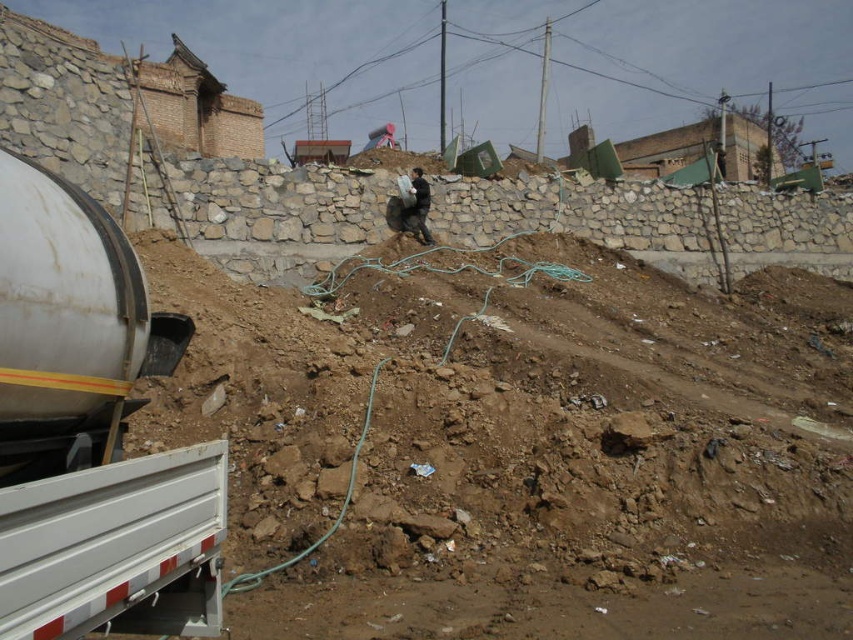
Measure the distance between white matte trailer truck at lower left and white metallic trailer truck at lower left.

white matte trailer truck at lower left and white metallic trailer truck at lower left are 1.12 meters apart from each other.

Does white matte trailer truck at lower left come behind white metallic trailer truck at lower left?

Yes.

Identify the location of white matte trailer truck at lower left. The image size is (853, 640). (88, 422).

Can you confirm if brown dirt at center is smaller than white metallic trailer truck at lower left?

Actually, brown dirt at center might be larger than white metallic trailer truck at lower left.

Who is positioned more to the right, brown dirt at center or white metallic trailer truck at lower left?

brown dirt at center

The height and width of the screenshot is (640, 853). What are the coordinates of `brown dirt at center` in the screenshot? It's located at (520, 451).

Is brown dirt at center above dark gray fabric bag at upper center?

Actually, brown dirt at center is below dark gray fabric bag at upper center.

Which is below, brown dirt at center or dark gray fabric bag at upper center?

brown dirt at center is below.

Is point (595, 406) positioned in front of point (421, 228)?

That is True.

Identify the location of brown dirt at center. This screenshot has height=640, width=853. (520, 451).